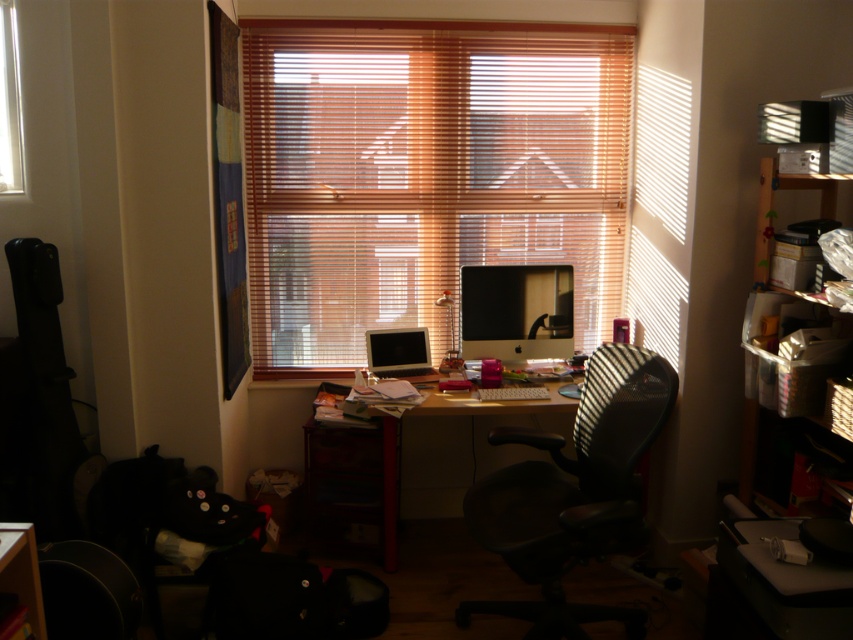
You are sitting in the black mesh office chair at center and want to reach the matte black monitor at center to adjust its settings. In which direction should you move relative to the monitor?

The black mesh office chair at center is to the right of the matte black monitor at center, so you should move to your left to reach the monitor.

You need to decide which object to clean first between the wooden blinds at center and the transparent glass window at upper left. Based on their sizes, which one requires more effort to clean?

The wooden blinds at center is larger in size than the transparent glass window at upper left, so it requires more effort to clean.

You are a delivery robot that is 1.5 meters tall. You need to deliver a package to the desk in the home office. The path to the desk requires passing between the wooden blinds at center and the transparent glass window at upper left. Can you fit through the space between them?

The distance between the wooden blinds at center and the transparent glass window at upper left is 1.48 meters, which is slightly less than the robot height of 1.5 meters. Therefore, the robot cannot safely pass through the space between them.